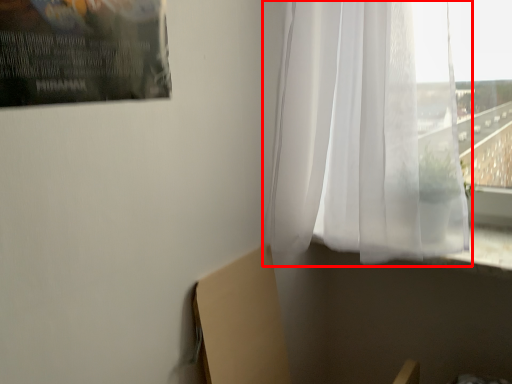
Question: Where is curtain (annotated by the red box) located in relation to cardboard box in the image?

Choices:
 (A) right
 (B) left

Answer: (A)